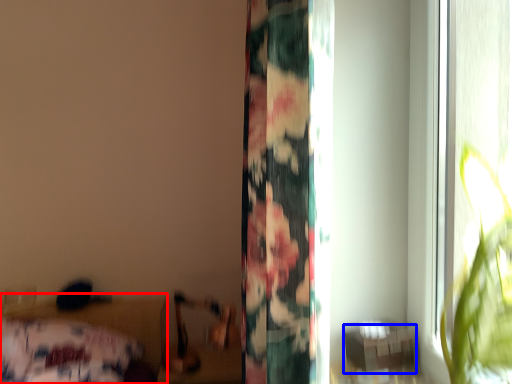
Question: Among these objects, which one is farthest to the camera, bed (highlighted by a red box) or table (highlighted by a blue box)?

Choices:
 (A) bed
 (B) table

Answer: (A)